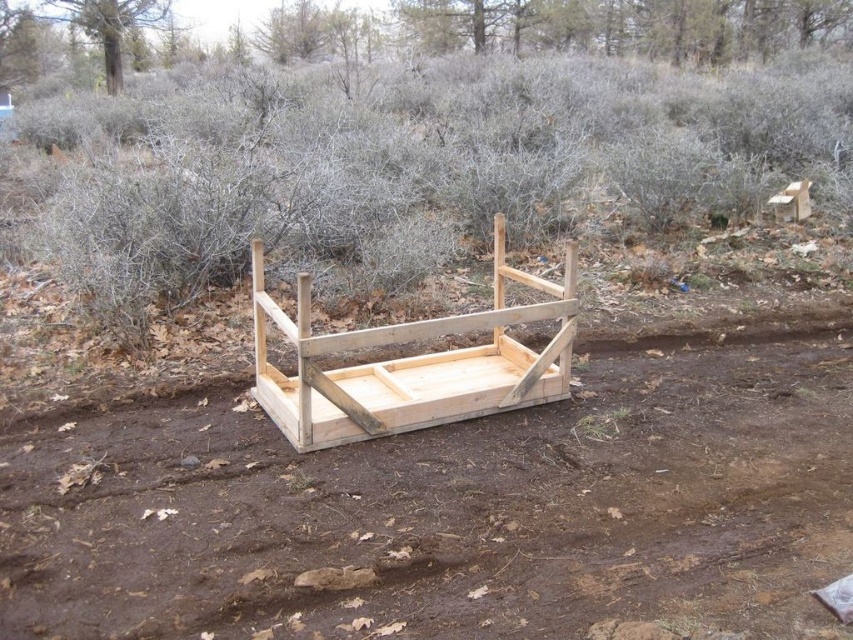
Can you confirm if natural wood mud tray at center is bigger than light brown wood bed frame at center?

Correct, natural wood mud tray at center is larger in size than light brown wood bed frame at center.

Find the location of a particular element. natural wood mud tray at center is located at coordinates (447, 512).